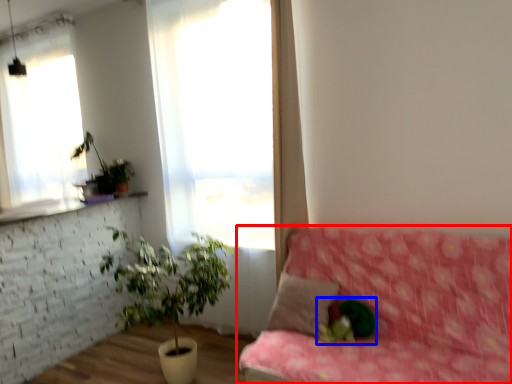
Question: Which object is further to the camera taking this photo, studio couch (highlighted by a red box) or plant (highlighted by a blue box)?

Choices:
 (A) studio couch
 (B) plant

Answer: (B)